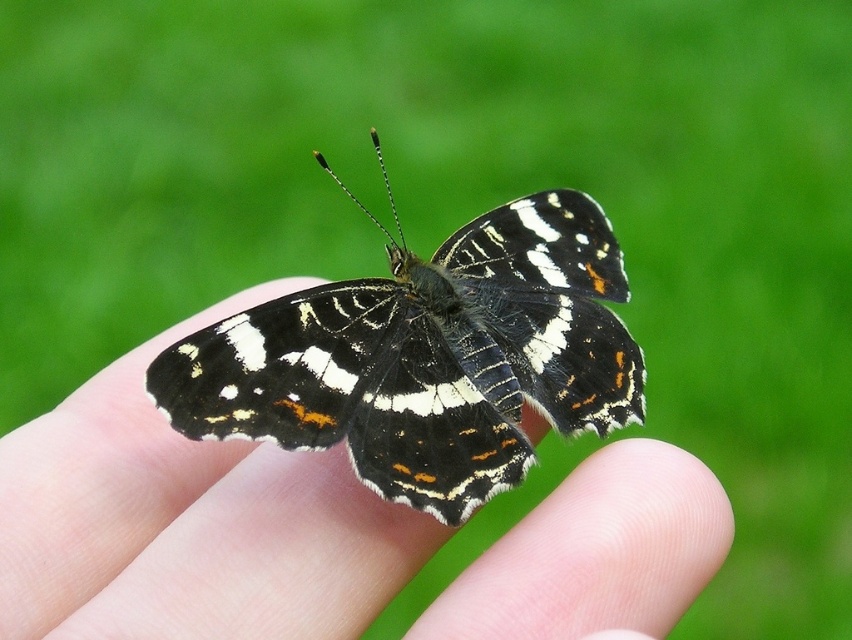
You are a nature photographer trying to capture both the matte black butterfly at center and the black and white butterfly at center in a single frame. Based on their sizes, which butterfly would appear smaller in your photo?

The matte black butterfly at center appears smaller in the photo because it is shorter than the black and white butterfly at center.

You are a nature photographer holding your camera. You see a matte black butterfly at center and a black and white butterfly at center. Can you focus on both butterflies at the same time?

The matte black butterfly at center is 4.89 inches from black and white butterfly at center. Since they are close to each other, you can focus on both butterflies at the same time.